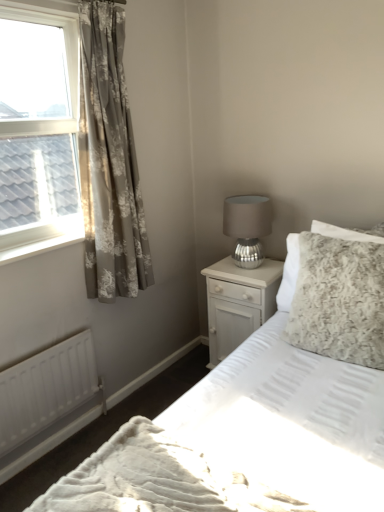
Question: Is white painted wood at left not close to floral-patterned fabric curtain at left?

Choices:
 (A) yes
 (B) no

Answer: (B)

Question: Does white painted wood at left have a smaller size compared to floral-patterned fabric curtain at left?

Choices:
 (A) no
 (B) yes

Answer: (B)

Question: Is white painted wood at left aimed at floral-patterned fabric curtain at left?

Choices:
 (A) yes
 (B) no

Answer: (B)

Question: Can you confirm if white painted wood at left is positioned to the left of floral-patterned fabric curtain at left?

Choices:
 (A) no
 (B) yes

Answer: (B)

Question: Is white painted wood at left outside floral-patterned fabric curtain at left?

Choices:
 (A) no
 (B) yes

Answer: (B)

Question: Can you confirm if white painted wood at left is taller than floral-patterned fabric curtain at left?

Choices:
 (A) no
 (B) yes

Answer: (A)

Question: Would you say fluffy white pillow at right is part of clear glass window at upper left's contents?

Choices:
 (A) no
 (B) yes

Answer: (A)

Question: Does clear glass window at upper left have a lesser width compared to fluffy white pillow at right?

Choices:
 (A) yes
 (B) no

Answer: (A)

Question: Is clear glass window at upper left positioned in front of fluffy white pillow at right?

Choices:
 (A) no
 (B) yes

Answer: (B)

Question: Considering the relative sizes of clear glass window at upper left and fluffy white pillow at right in the image provided, is clear glass window at upper left wider than fluffy white pillow at right?

Choices:
 (A) yes
 (B) no

Answer: (B)

Question: Is clear glass window at upper left far from fluffy white pillow at right?

Choices:
 (A) yes
 (B) no

Answer: (A)

Question: From a real-world perspective, is clear glass window at upper left on top of fluffy white pillow at right?

Choices:
 (A) yes
 (B) no

Answer: (A)

Question: Is white glossy nightstand at center-right thinner than white textured bed at center?

Choices:
 (A) no
 (B) yes

Answer: (B)